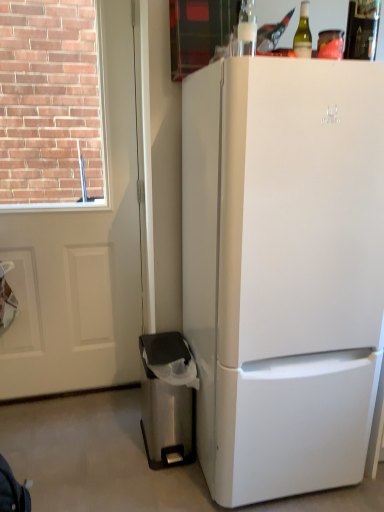
The width and height of the screenshot is (384, 512). Identify the location of vacant area that lies between white matte refrigerator at right and stainless steel trash can at lower left. (190, 490).